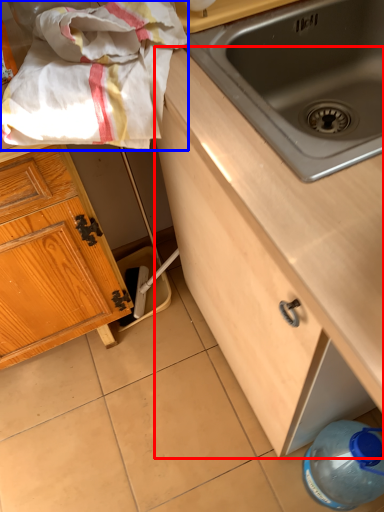
Question: Among these objects, which one is nearest to the camera, cabinetry (highlighted by a red box) or blanket (highlighted by a blue box)?

Choices:
 (A) cabinetry
 (B) blanket

Answer: (A)